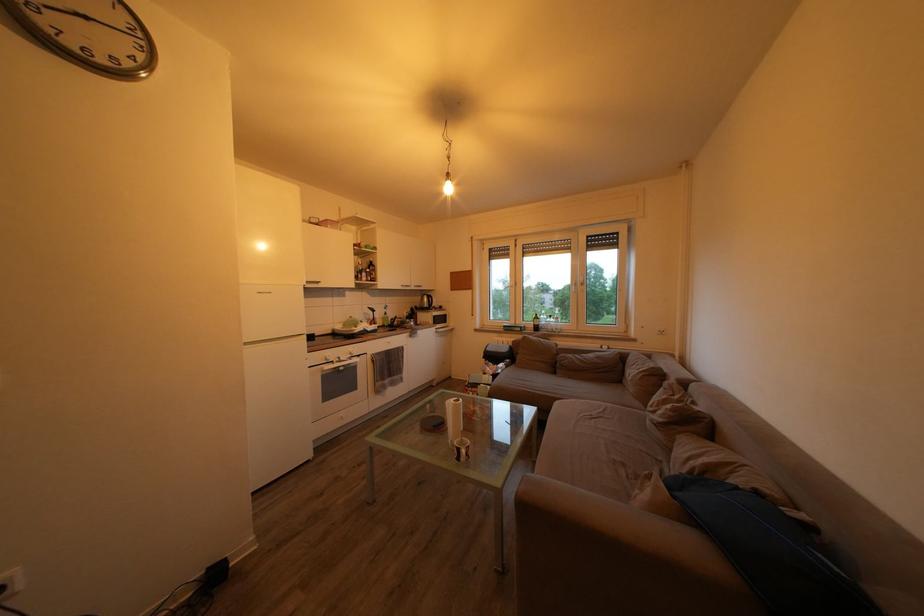
Where is `faucet handle`? faucet handle is located at coordinates (371, 315).